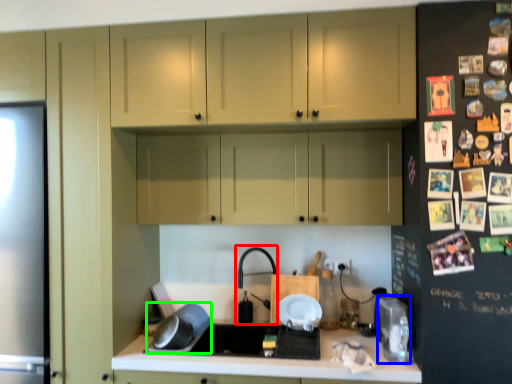
Question: Based on their relative distances, which object is farther from faucet (highlighted by a red box)? Choose from appliance (highlighted by a blue box) and appliance (highlighted by a green box).

Choices:
 (A) appliance
 (B) appliance

Answer: (A)